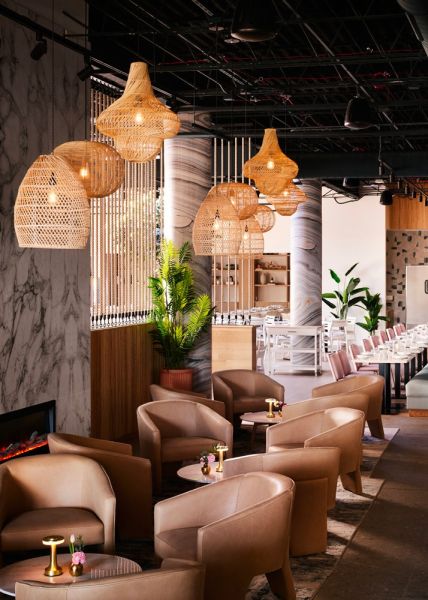
Find the location of a particular element. This screenshot has width=428, height=600. floor is located at coordinates (338, 529).